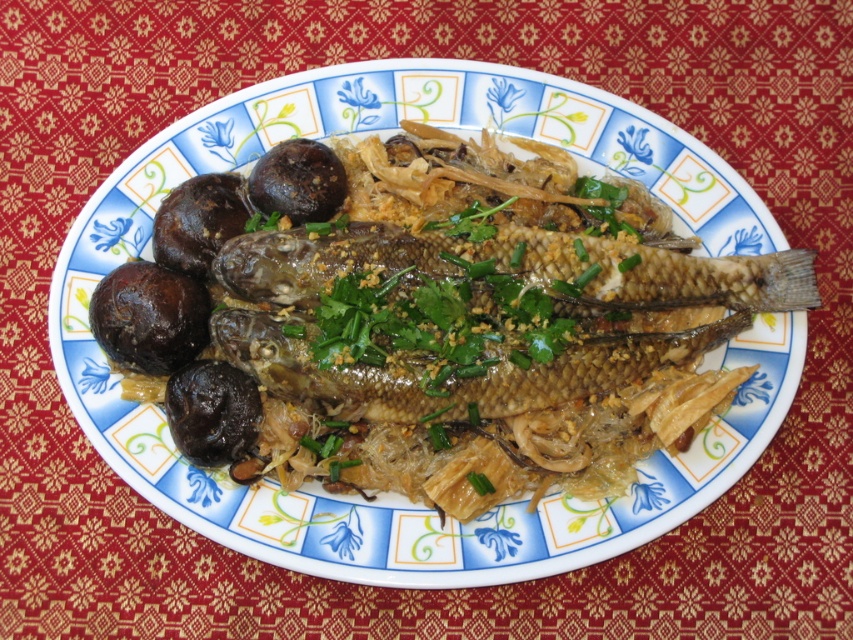
Between brown glossy mushrooms at left and glossy brown fish at center, which one appears on the left side from the viewer's perspective?

brown glossy mushrooms at left

Is brown glossy mushrooms at left taller than glossy brown fish at center?

Correct, brown glossy mushrooms at left is much taller as glossy brown fish at center.

What do you see at coordinates (424, 316) in the screenshot? This screenshot has width=853, height=640. I see `brown glossy mushrooms at left` at bounding box center [424, 316].

At what (x,y) coordinates should I click in order to perform the action: click on brown glossy mushrooms at left. Please return your answer as a coordinate pair (x, y). The height and width of the screenshot is (640, 853). Looking at the image, I should click on (424, 316).

Is brown glossy mushrooms at left above golden brown fish at center?

No.

What are the coordinates of `brown glossy mushrooms at left` in the screenshot? It's located at point(424,316).

This screenshot has width=853, height=640. Identify the location of brown glossy mushrooms at left. (424, 316).

Between golden brown fish at center and glossy brown fish at center, which one is positioned higher?

golden brown fish at center

Does point (605, 301) come closer to viewer compared to point (287, 396)?

Yes, point (605, 301) is closer to viewer.

Image resolution: width=853 pixels, height=640 pixels. In order to click on golden brown fish at center in this screenshot , I will do `click(515, 268)`.